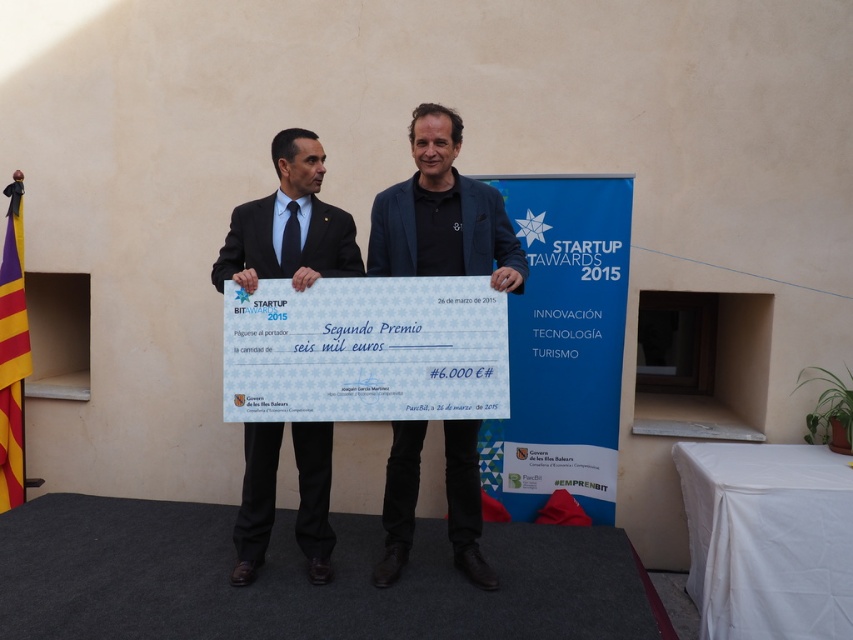
How much distance is there between dark blue woolen suit at center and matte black suit at center?

They are 31.48 inches apart.

Measure the distance between point (456, 227) and camera.

The distance of point (456, 227) from camera is 2.94 meters.

Where is `dark blue woolen suit at center`? Image resolution: width=853 pixels, height=640 pixels. dark blue woolen suit at center is located at coordinates pyautogui.click(x=442, y=230).